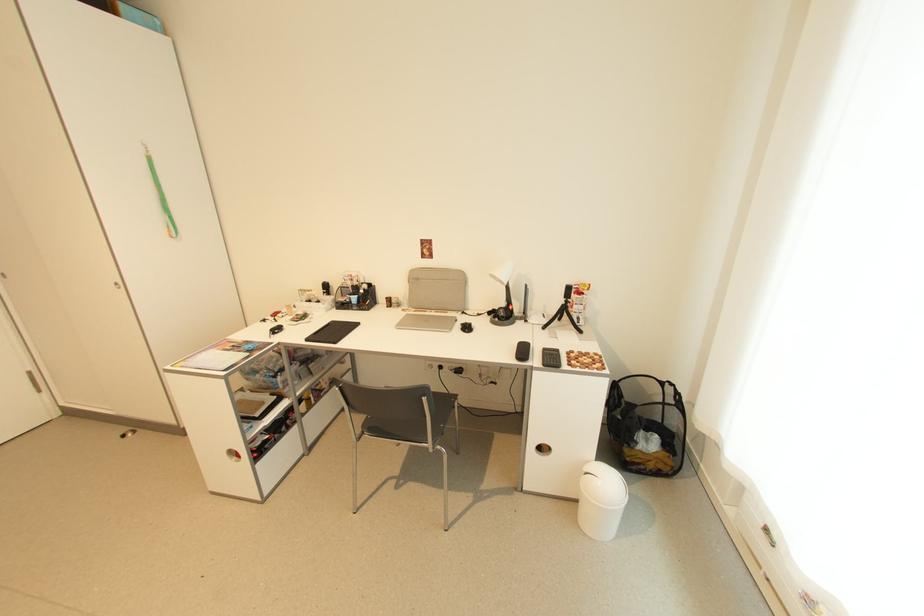
Locate an element on the screen. This screenshot has height=616, width=924. green lanyard is located at coordinates (161, 195).